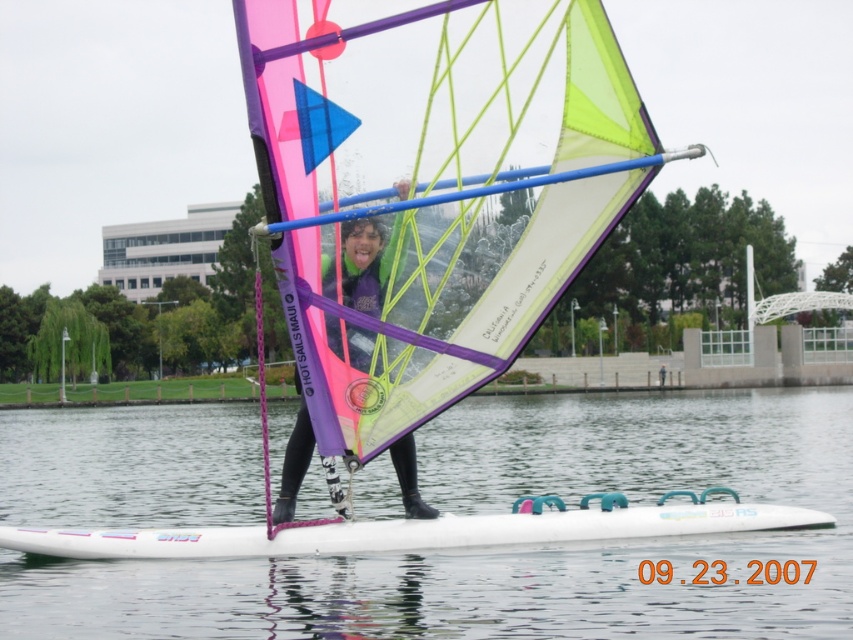
Question: Which point is farther to the camera?

Choices:
 (A) (642, 612)
 (B) (194, 544)
 (C) (364, 225)
 (D) (610, 44)

Answer: (B)

Question: Does neon pink/transparent sail at center appear over pink matte windsurf sail at center?

Choices:
 (A) no
 (B) yes

Answer: (B)

Question: Is white foam board at center bigger than white matte surfboard at center?

Choices:
 (A) no
 (B) yes

Answer: (B)

Question: Which is farther from the neon pink/transparent sail at center?

Choices:
 (A) pink matte windsurf sail at center
 (B) white foam board at center

Answer: (B)

Question: Which is nearer to the white matte surfboard at center?

Choices:
 (A) neon pink/transparent sail at center
 (B) pink matte windsurf sail at center

Answer: (B)

Question: Can you confirm if neon pink/transparent sail at center is positioned to the right of pink matte windsurf sail at center?

Choices:
 (A) no
 (B) yes

Answer: (B)